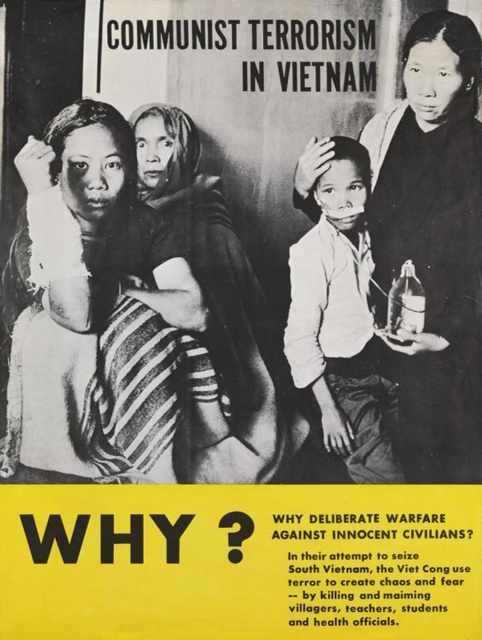
You are an art conservator examining the poster. You notice two areas of concern on the figures depicted. The smooth black fabric at right belongs to a character, and the white matte shirt at center belongs to another. Which of these fabrics is positioned closer to the viewer?

The smooth black fabric at right is closer to the viewer than the white matte shirt at center.

Based on the scene described in the black and white propaganda poster, which object, the smooth black fabric at right or the white matte shirt at center, occupies more horizontal space in the image?

The smooth black fabric at right has a greater width than the white matte shirt at center, so it occupies more horizontal space.